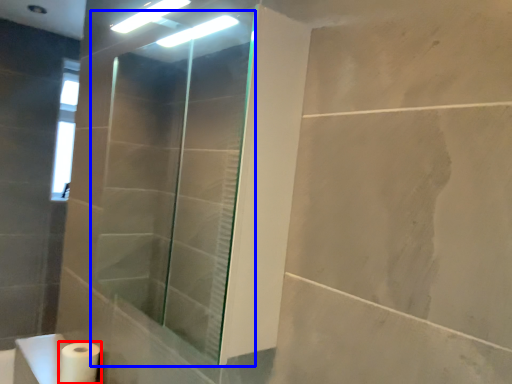
Question: Which of the following is the closest to the observer, toilet paper (highlighted by a red box) or shower door (highlighted by a blue box)?

Choices:
 (A) toilet paper
 (B) shower door

Answer: (B)